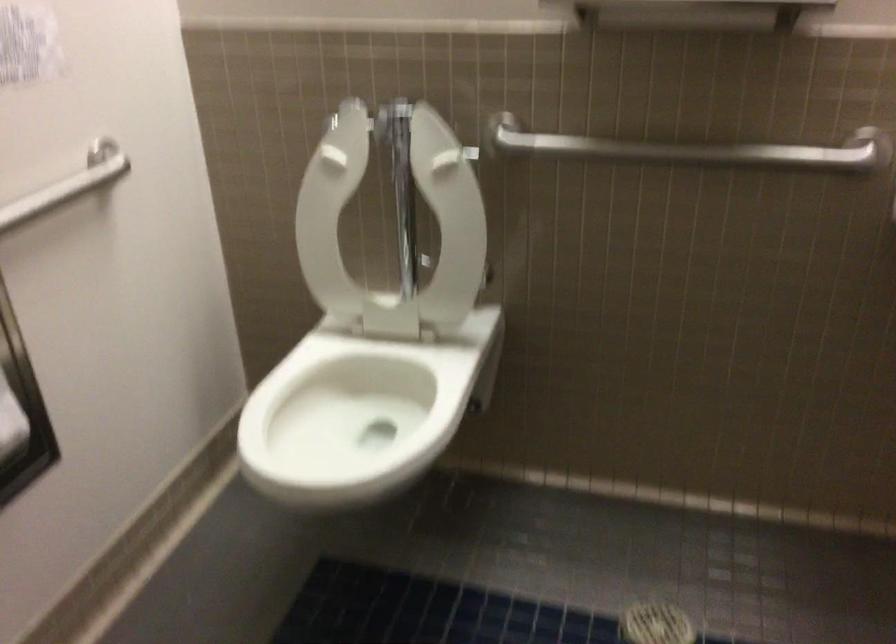
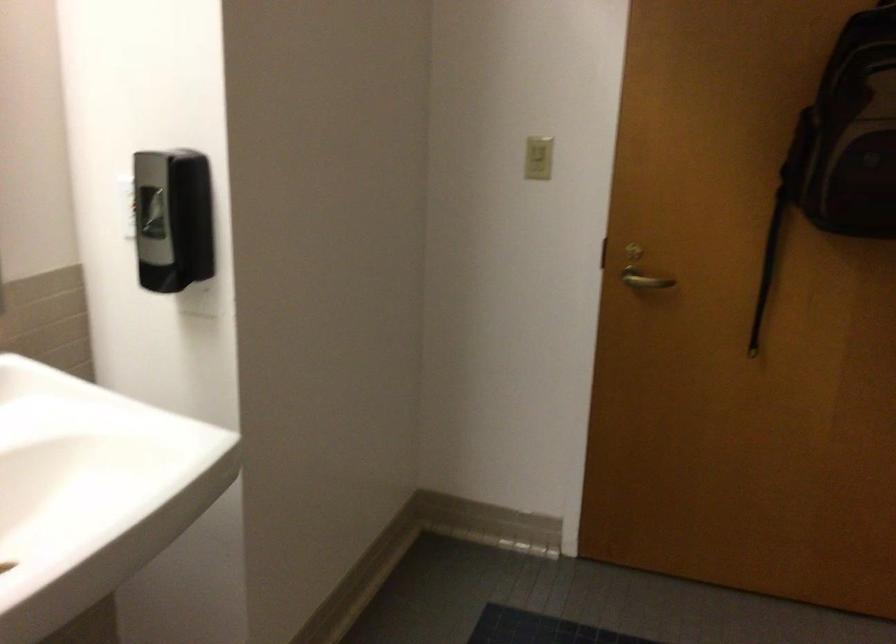
Question: How did the camera likely rotate?

Choices:
 (A) Left
 (B) Right
 (C) Up
 (D) Down

Answer: (B)